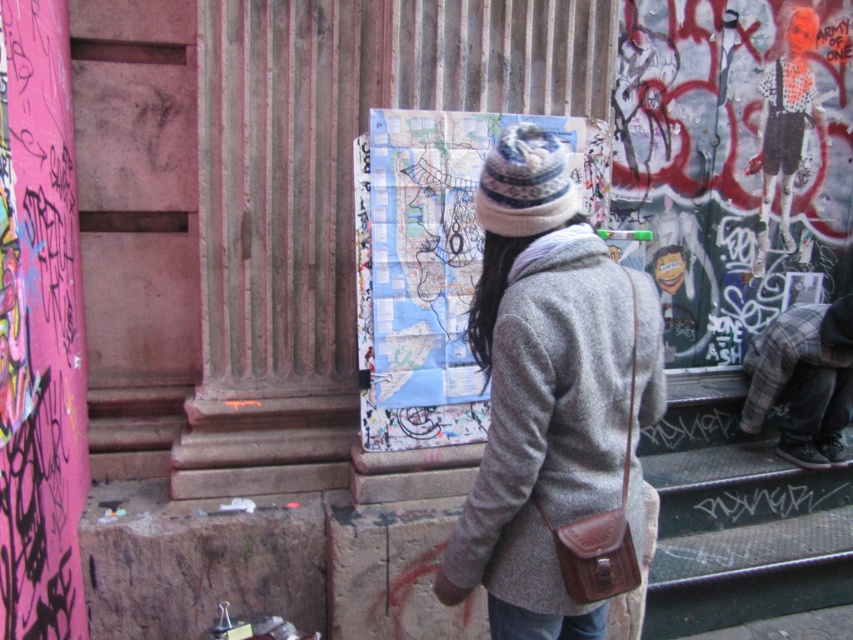
Based on the photo, you are a painter who wants to climb the black metal stairs at lower right to reach the graffiti on the upper wall. You are wearing the plaid fabric pants at lower right. Can you climb the stairs without the pants getting caught?

The black metal stairs at lower right has a greater height compared to plaid fabric pants at lower right, so yes, you can climb the stairs without the pants getting caught since the stairs are taller than the pants.